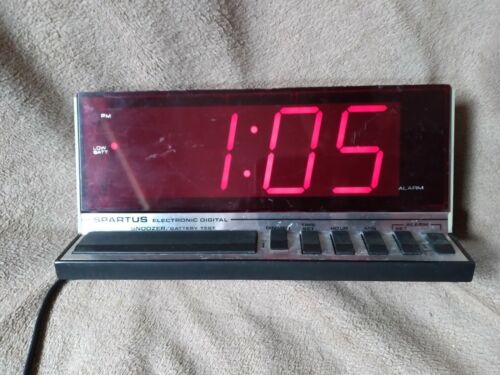
At what (x,y) coordinates should I click in order to perform the action: click on silver bezel on alarm clock. Please return your answer as a coordinate pair (x, y). Looking at the image, I should click on (450, 212).